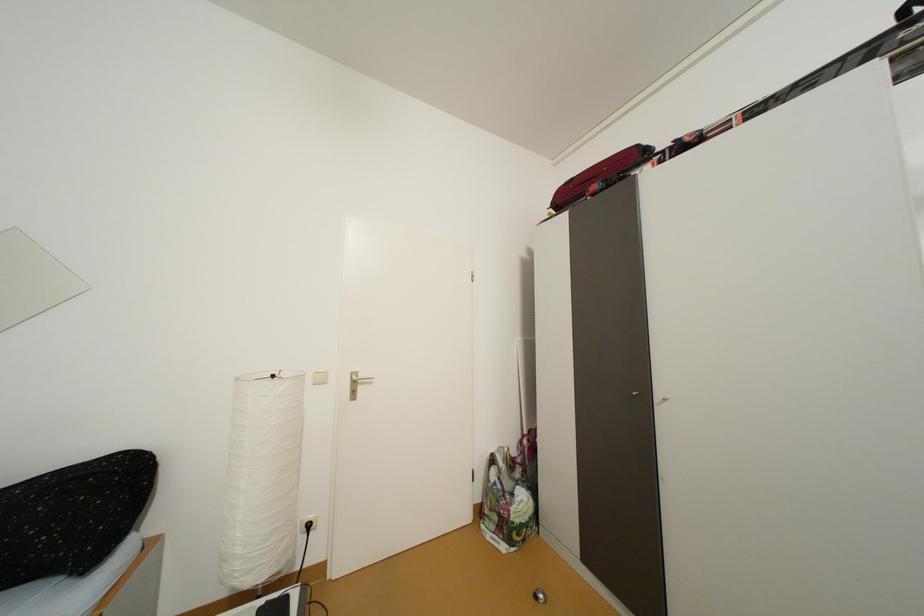
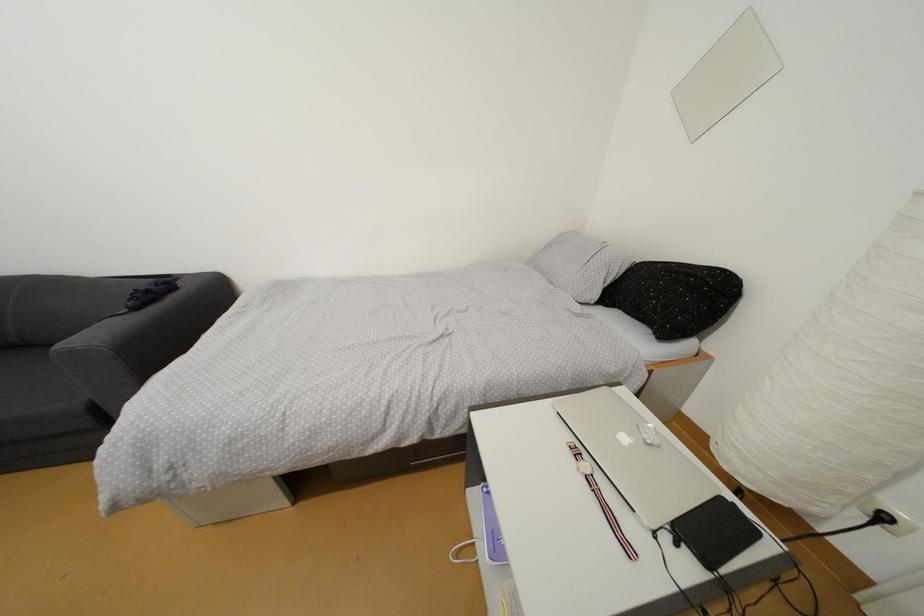
First-person continuous shooting, in which direction is the camera rotating?

The camera's rotation is toward left-down.